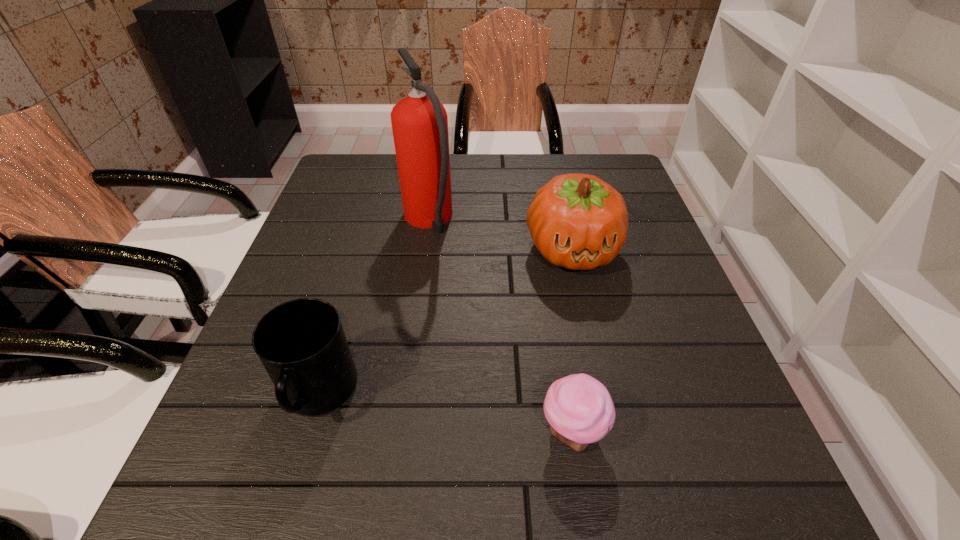
You are a GUI agent. You are given a task and a screenshot of the screen. Output one action in this format:
    pyautogui.click(x=<x>, y=<y>)
    Task: Click on the third object from right to left
    
    Given the screenshot: What is the action you would take?
    pyautogui.click(x=419, y=122)

Identify the location of the tallest object. (419, 122).

I want to click on the third shortest object, so click(577, 221).

I want to click on the leftmost object, so click(x=301, y=343).

This screenshot has height=540, width=960. In order to click on the second shortest object in this screenshot , I will do `click(301, 343)`.

Identify the location of the shortest object. point(579,408).

The width and height of the screenshot is (960, 540). Find the location of `free location located 0.230m on the handle side of the third object from right to left`. free location located 0.230m on the handle side of the third object from right to left is located at coordinates (438, 154).

The image size is (960, 540). Find the location of `vacant space located 0.200m on the handle side of the third object from right to left`. vacant space located 0.200m on the handle side of the third object from right to left is located at coordinates (438, 159).

The height and width of the screenshot is (540, 960). What are the coordinates of `free space located 0.300m on the side of the third shortest object with the cute face` in the screenshot? It's located at (610, 412).

What are the coordinates of `blank area located on the side of the second shortest object with the handle` in the screenshot? It's located at (288, 497).